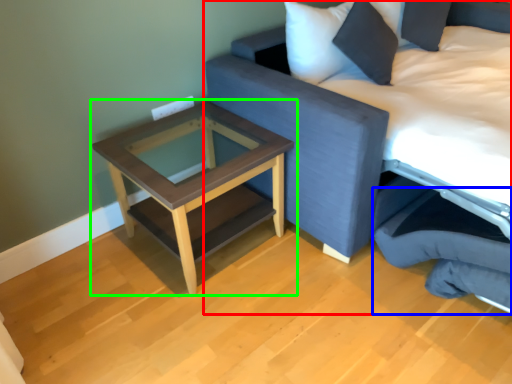
Question: Which is nearer to the studio couch (highlighted by a red box)? swivel chair (highlighted by a blue box) or table (highlighted by a green box).

Choices:
 (A) swivel chair
 (B) table

Answer: (A)